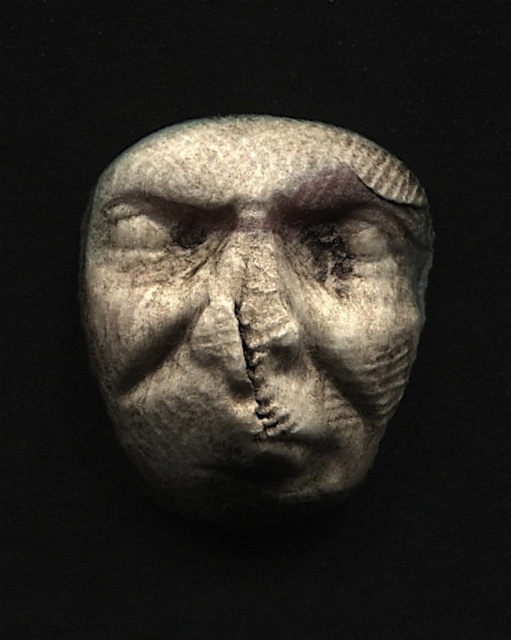
Which is more to the left, gray stone face at center or gray stone forehead at center?

gray stone face at center is more to the left.

Which is behind, point (129, 401) or point (176, 161)?

Point (129, 401)

Where is `gray stone face at center`? gray stone face at center is located at coordinates (253, 305).